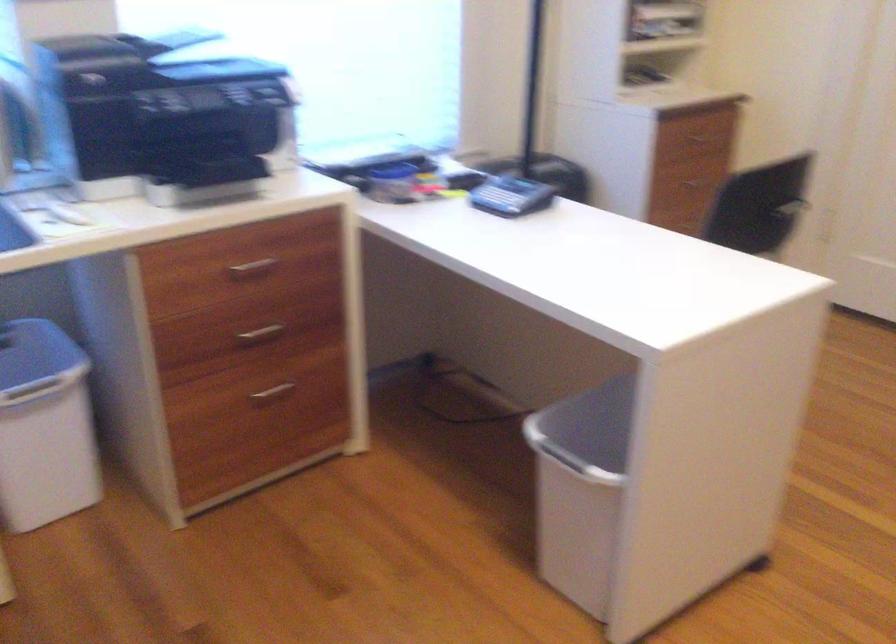
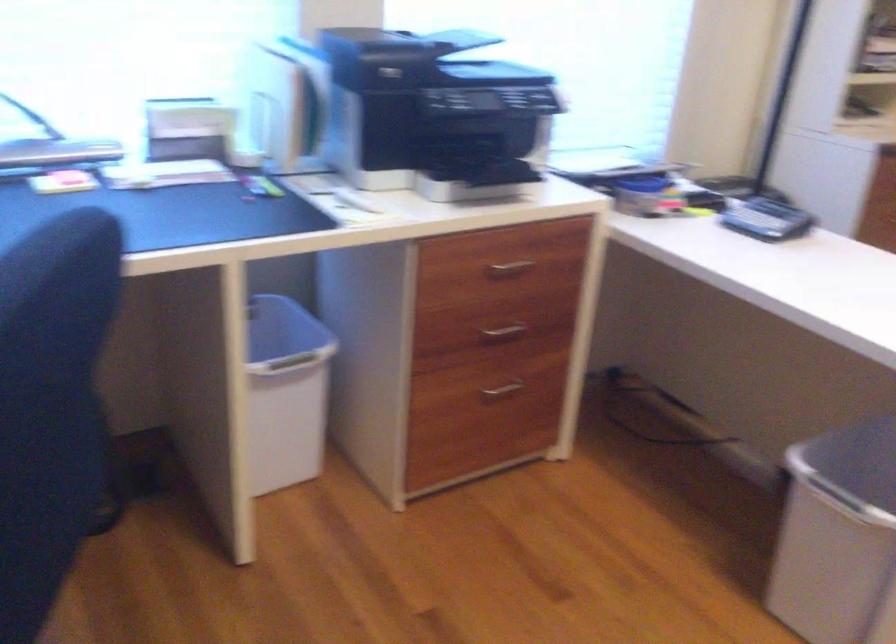
Find the pixel in the second image that matches point (270, 391) in the first image.

(501, 388)